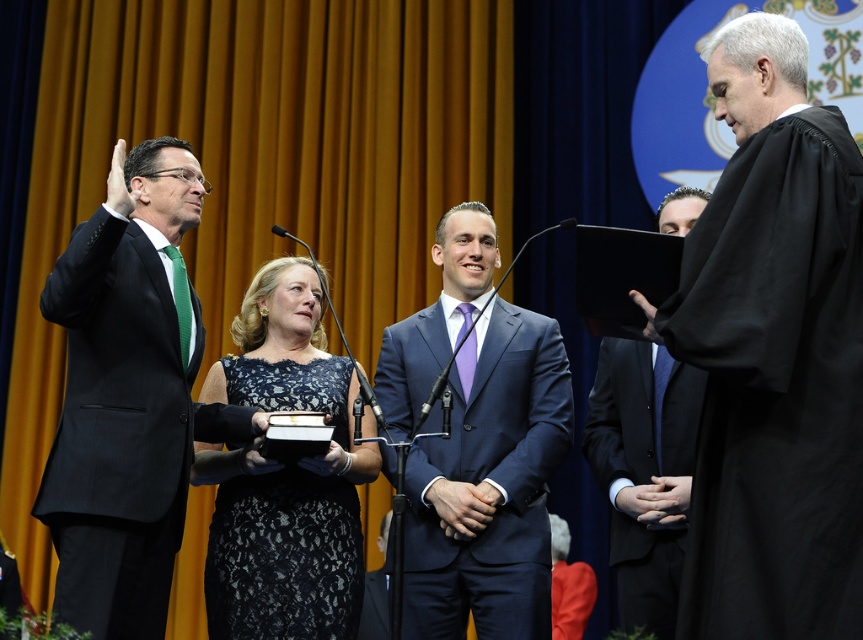
Question: Is black robe at right to the left of black matte suit at right from the viewer's perspective?

Choices:
 (A) no
 (B) yes

Answer: (A)

Question: Is black robe at right below lace dress at center?

Choices:
 (A) yes
 (B) no

Answer: (B)

Question: Which point is closer to the camera?

Choices:
 (A) black matte suit at right
 (B) shiny blue suit at center
 (C) black robe at right
 (D) lace dress at center

Answer: (C)

Question: Which is farther from the black pinstripe suit at left?

Choices:
 (A) black matte suit at right
 (B) black robe at right

Answer: (B)

Question: Which point appears closest to the camera in this image?

Choices:
 (A) (720, 42)
 (B) (186, 444)
 (C) (441, 232)
 (D) (639, 461)

Answer: (A)

Question: Is the position of shiny blue suit at center less distant than that of lace dress at center?

Choices:
 (A) no
 (B) yes

Answer: (A)